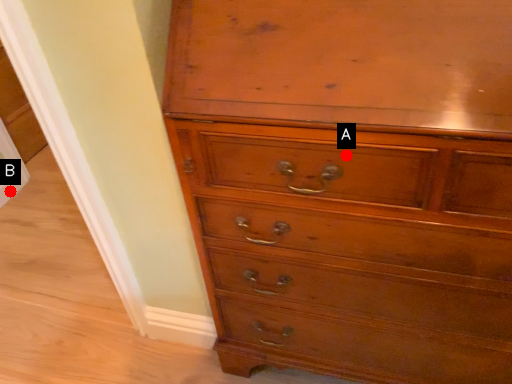
Question: Two points are circled on the image, labeled by A and B beside each circle. Which point appears farthest from the camera in this image?

Choices:
 (A) A is further
 (B) B is further

Answer: (B)